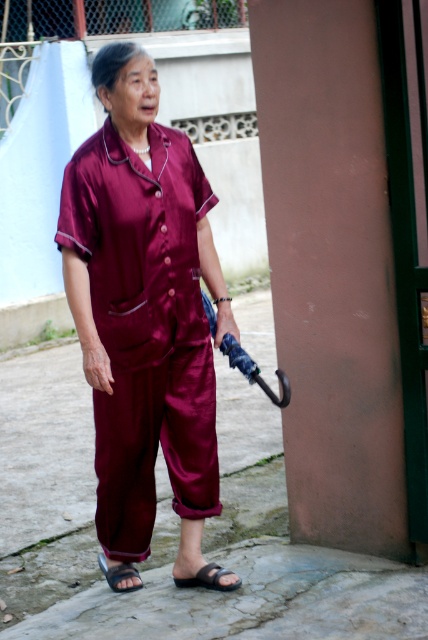
Question: Among these objects, which one is nearest to the camera?

Choices:
 (A) black rubber sandal at lower center
 (B) maroon satin pajamas at center

Answer: (B)

Question: Which point is farther to the camera?

Choices:
 (A) maroon satin pajamas at center
 (B) black leather sandal at lower center
 (C) black rubber sandal at lower center

Answer: (B)

Question: Which is farther from the black leather sandal at lower center?

Choices:
 (A) black rubber sandal at lower center
 (B) maroon satin pajamas at center

Answer: (B)

Question: Can you confirm if maroon satin pajamas at center is bigger than black leather sandal at lower center?

Choices:
 (A) no
 (B) yes

Answer: (B)

Question: Can you confirm if black rubber sandal at lower center is positioned above black leather sandal at lower center?

Choices:
 (A) yes
 (B) no

Answer: (A)

Question: From the image, what is the correct spatial relationship of maroon satin pajamas at center in relation to black leather sandal at lower center?

Choices:
 (A) left
 (B) right

Answer: (B)